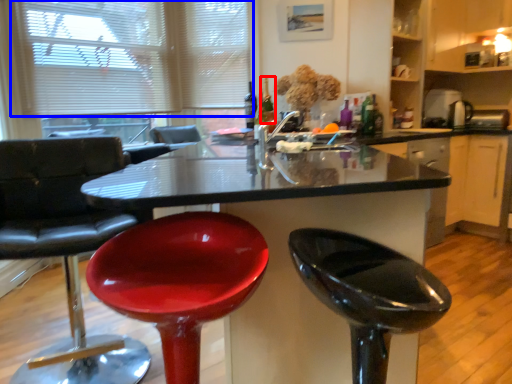
Question: Which point is closer to the camera, wine bottle (highlighted by a red box) or blind (highlighted by a blue box)?

Choices:
 (A) wine bottle
 (B) blind

Answer: (B)